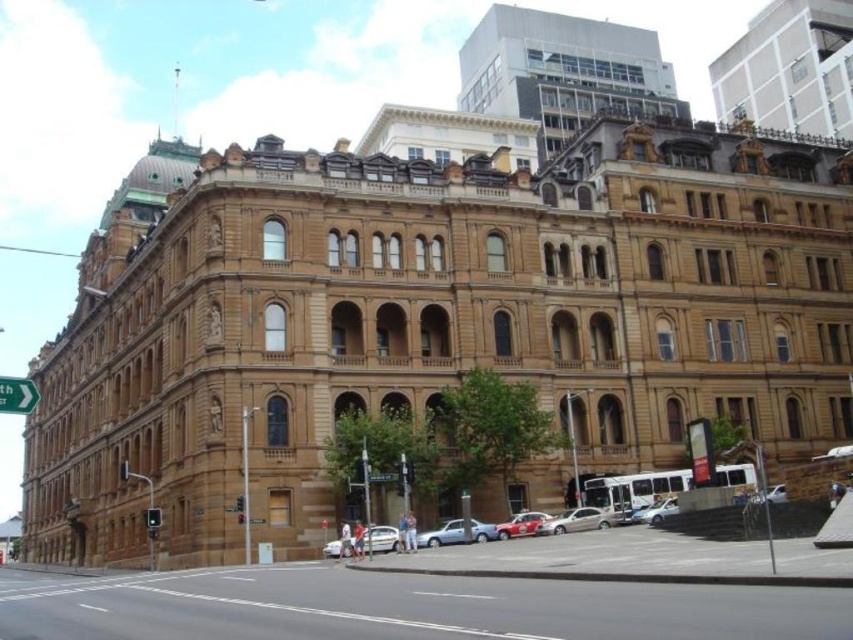
Question: Which object appears closest to the camera in this image?

Choices:
 (A) red glossy car at lower center
 (B) green glass traffic light at lower left
 (C) silver metallic sedan at lower center
 (D) silver metallic car at lower center

Answer: (C)

Question: Among these objects, which one is nearest to the camera?

Choices:
 (A) green plastic street sign at center
 (B) metallic at left

Answer: (A)

Question: From the image, what is the correct spatial relationship of silver metallic sedan at lower center in relation to green plastic arrow at lower left?

Choices:
 (A) left
 (B) right

Answer: (B)

Question: Does silver metallic car at lower center have a smaller size compared to green glass traffic light at lower left?

Choices:
 (A) yes
 (B) no

Answer: (A)

Question: Which of these objects is positioned farthest from the white matte car at lower center?

Choices:
 (A) metallic traffic light at lower left
 (B) silver metallic sedan at lower center

Answer: (A)

Question: Can you confirm if green plastic street sign at center is positioned to the left of metallic at left?

Choices:
 (A) no
 (B) yes

Answer: (A)